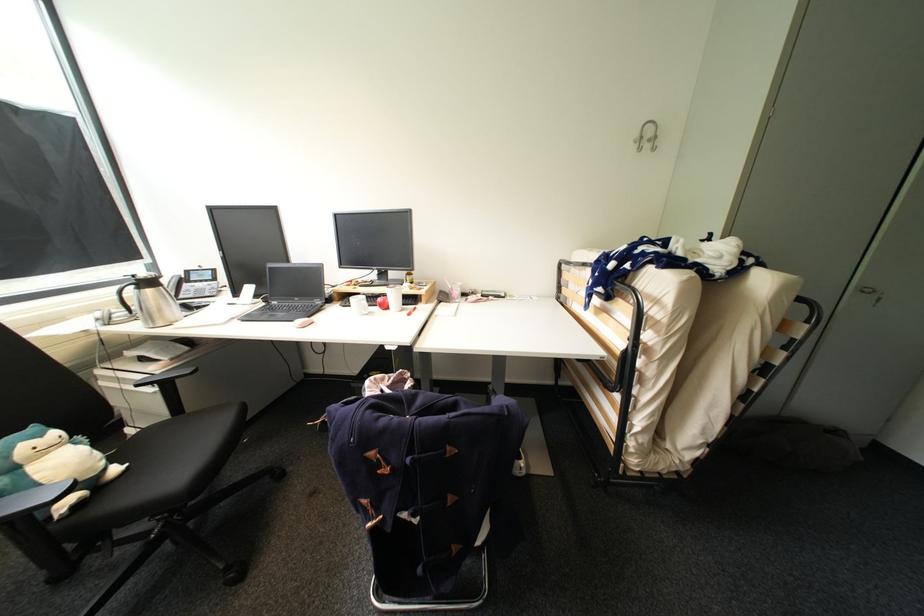
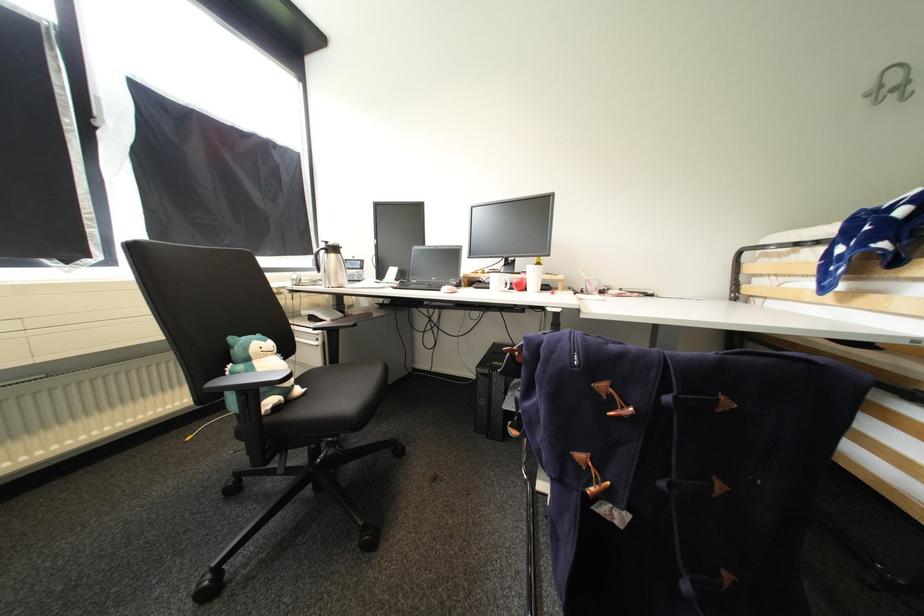
Question: Based on the continuous images, in which direction is the camera rotating? Reply with the corresponding letter.

Choices:
 (A) Left
 (B) Right
 (C) Up
 (D) Down

Answer: (A)